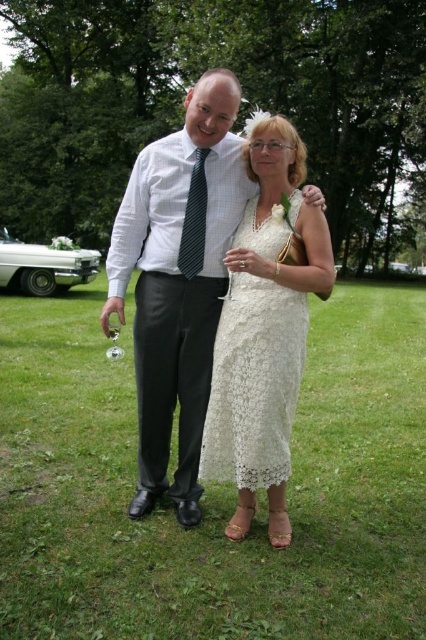
Question: Can you confirm if matte white shirt at center is thinner than striped fabric tie at center?

Choices:
 (A) no
 (B) yes

Answer: (A)

Question: Among these objects, which one is farthest from the camera?

Choices:
 (A) striped fabric tie at center
 (B) matte white shirt at center

Answer: (B)

Question: Is green grass at center to the right of matte white shirt at center from the viewer's perspective?

Choices:
 (A) yes
 (B) no

Answer: (A)

Question: Which object appears farthest from the camera in this image?

Choices:
 (A) white lace dress at center
 (B) matte white shirt at center

Answer: (B)

Question: Which point is farther from the camera taking this photo?

Choices:
 (A) (x=172, y=339)
 (B) (x=196, y=227)
 (C) (x=327, y=595)
 (D) (x=249, y=216)

Answer: (D)

Question: Is matte white shirt at center positioned behind striped fabric tie at center?

Choices:
 (A) yes
 (B) no

Answer: (A)